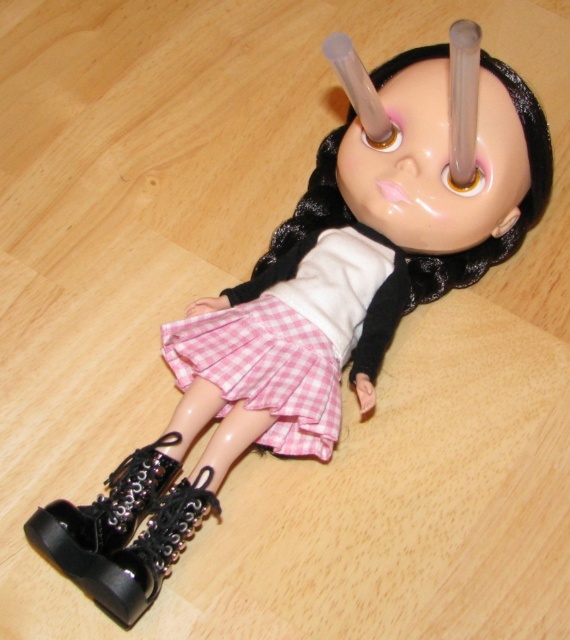
You are a tailor trying to adjust the length of the pink checkered skirt at center and the black leather boot at lower left. Based on their positions, which item is higher up on the doll?

The pink checkered skirt at center is much taller than the black leather boot at lower left, so the skirt is higher up on the doll.

Based on the photo, you are a fashion designer looking at the doll. You need to place a new accessory between the pink checkered skirt at center and the black leather boot at lower left. Which side of the boot should you place it on?

The pink checkered skirt at center is on the right side of the black leather boot at lower left, so you should place the accessory to the right of the black leather boot at lower left to align with the skirt.